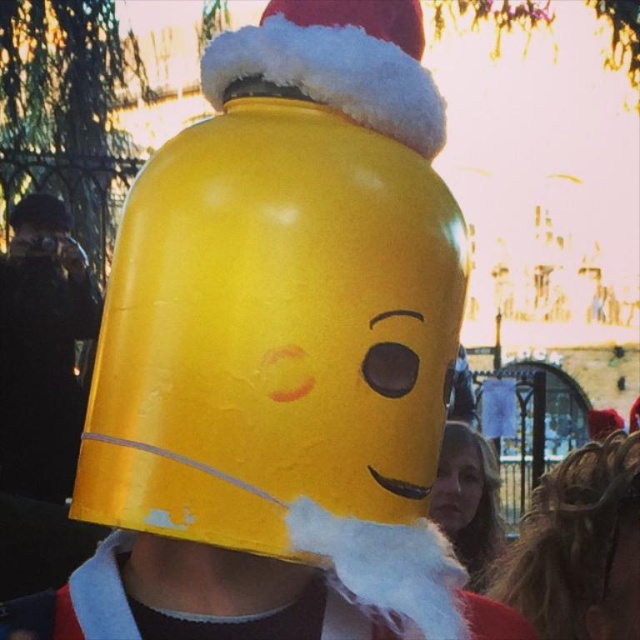
You are trying to determine if the matte yellow helmet at center can fully cover the smooth skin face at lower right. Based on their sizes, is this possible?

The matte yellow helmet at center might be wider than smooth skin face at lower right, so it could potentially cover the face depending on the exact dimensions and positioning.

You are standing in front of the helmet and want to place a sticker on the point that is closer to you. Which point should you choose between point [323,422] and point [480,460]?

Point [323,422] is closer to the camera than point [480,460], so you should choose point [323,422] to place the sticker.

You are an artist trying to draw this scene. You need to decide which object should be drawn first based on their sizes. Which object, the matte yellow helmet at center or the smooth skin face at lower right, should you draw first considering their sizes?

The matte yellow helmet at center has a larger size compared to the smooth skin face at lower right, so you should draw the matte yellow helmet at center first to ensure proper scaling when adding smaller details later.